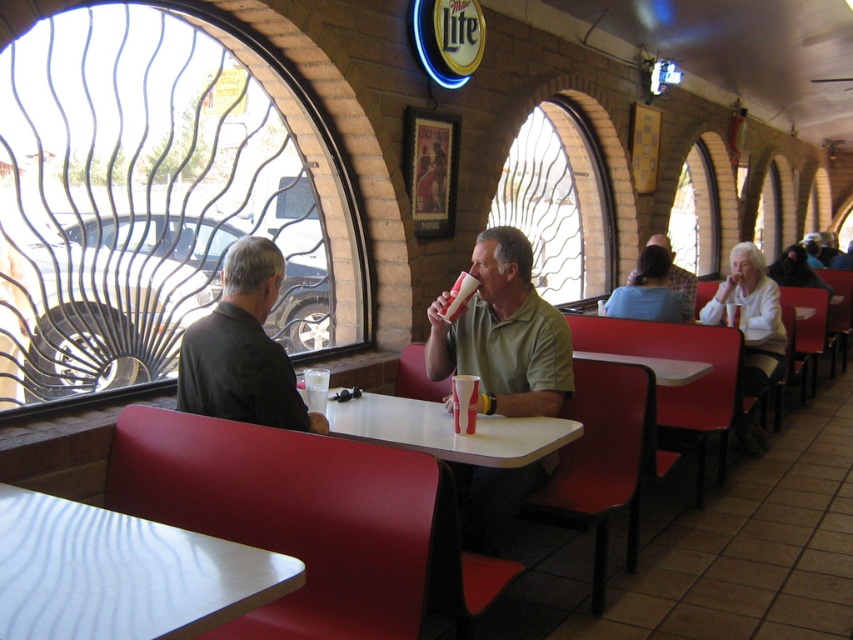
Question: Is white textured table at lower left to the left of matte green polo shirt at center from the viewer's perspective?

Choices:
 (A) no
 (B) yes

Answer: (B)

Question: Can you confirm if white paper cup at table center is wider than plaid shirt at center?

Choices:
 (A) no
 (B) yes

Answer: (A)

Question: Which point is farther to the camera?

Choices:
 (A) 498,541
 (B) 463,397
 (C) 78,516

Answer: (A)

Question: Is metallic wire at left wider than plaid shirt at center?

Choices:
 (A) no
 (B) yes

Answer: (B)

Question: Which object is the farthest from the white textured table at lower left?

Choices:
 (A) matte green polo shirt at center
 (B) plaid shirt at center
 (C) black matte shirt at left

Answer: (B)

Question: Which point is closer to the camera?

Choices:
 (A) (265, 358)
 (B) (558, 433)
 (C) (454, 336)
 (D) (463, 404)

Answer: (A)